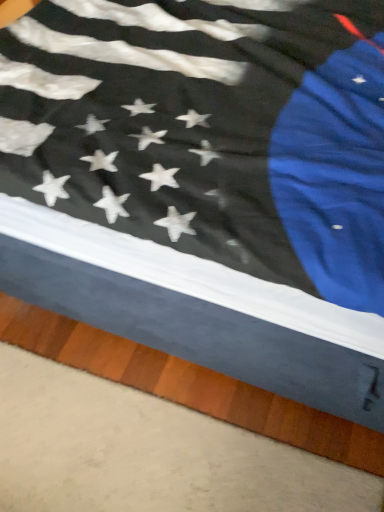
Question: Does point (276, 397) appear closer or farther from the camera than point (56, 34)?

Choices:
 (A) closer
 (B) farther

Answer: (B)

Question: In terms of height, does smooth wood plank at lower right look taller or shorter compared to black matte flag at center?

Choices:
 (A) short
 (B) tall

Answer: (A)

Question: From a real-world perspective, relative to black matte flag at center, is smooth wood plank at lower right vertically above or below?

Choices:
 (A) below
 (B) above

Answer: (A)

Question: Visually, is black matte flag at center positioned to the left or to the right of smooth wood plank at lower right?

Choices:
 (A) right
 (B) left

Answer: (A)

Question: From the image's perspective, is black matte flag at center above or below smooth wood plank at lower right?

Choices:
 (A) below
 (B) above

Answer: (B)

Question: Is point click(153, 173) positioned closer to the camera than point click(258, 423)?

Choices:
 (A) farther
 (B) closer

Answer: (B)

Question: Would you say black matte flag at center is inside or outside smooth wood plank at lower right?

Choices:
 (A) inside
 (B) outside

Answer: (B)